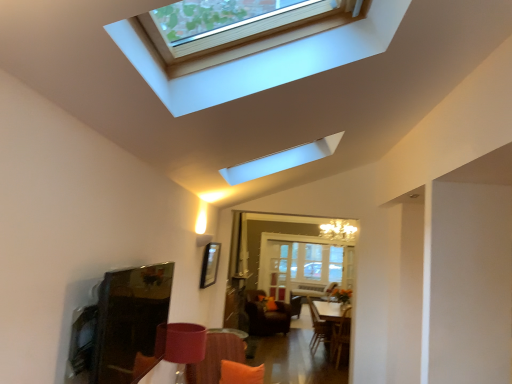
Question: Is clear glass door at center oriented towards matte white window at upper center?

Choices:
 (A) no
 (B) yes

Answer: (B)

Question: Considering the relative sizes of clear glass door at center and matte white window at upper center in the image provided, is clear glass door at center wider than matte white window at upper center?

Choices:
 (A) yes
 (B) no

Answer: (B)

Question: Is clear glass door at center thinner than matte white window at upper center?

Choices:
 (A) no
 (B) yes

Answer: (B)

Question: From a real-world perspective, is clear glass door at center positioned over matte white window at upper center based on gravity?

Choices:
 (A) yes
 (B) no

Answer: (B)

Question: From the image's perspective, is clear glass door at center on top of matte white window at upper center?

Choices:
 (A) yes
 (B) no

Answer: (B)

Question: From a real-world perspective, is white glossy table at center physically located above or below velvet brown swivel chair at center, the 2th swivel chair when ordered from front to back?

Choices:
 (A) above
 (B) below

Answer: (B)

Question: From the image's perspective, is white glossy table at center located above or below velvet brown swivel chair at center, placed as the first swivel chair when sorted from left to right?

Choices:
 (A) below
 (B) above

Answer: (B)

Question: Would you say white glossy table at center is inside or outside velvet brown swivel chair at center, the 2th swivel chair when ordered from front to back?

Choices:
 (A) outside
 (B) inside

Answer: (A)

Question: Does point (334, 332) appear closer or farther from the camera than point (245, 307)?

Choices:
 (A) farther
 (B) closer

Answer: (B)

Question: From the image's perspective, is velvet brown swivel chair at center, placed as the first swivel chair when sorted from left to right, positioned above or below white glossy table at center?

Choices:
 (A) below
 (B) above

Answer: (A)

Question: Based on their sizes in the image, would you say velvet brown swivel chair at center, which is counted as the 2th swivel chair, starting from the right, is bigger or smaller than white glossy table at center?

Choices:
 (A) small
 (B) big

Answer: (A)

Question: From their relative heights in the image, would you say velvet brown swivel chair at center, placed as the first swivel chair when sorted from left to right, is taller or shorter than white glossy table at center?

Choices:
 (A) short
 (B) tall

Answer: (B)

Question: In the image, is velvet brown swivel chair at center, placed as the 1th swivel chair when sorted from back to front, positioned in front of or behind white glossy table at center?

Choices:
 (A) behind
 (B) front

Answer: (A)

Question: From a real-world perspective, relative to orange fabric pillow at lower center, is velvet orange armchair at lower center vertically above or below?

Choices:
 (A) above
 (B) below

Answer: (B)

Question: In terms of width, does velvet orange armchair at lower center look wider or thinner when compared to orange fabric pillow at lower center?

Choices:
 (A) thin
 (B) wide

Answer: (B)